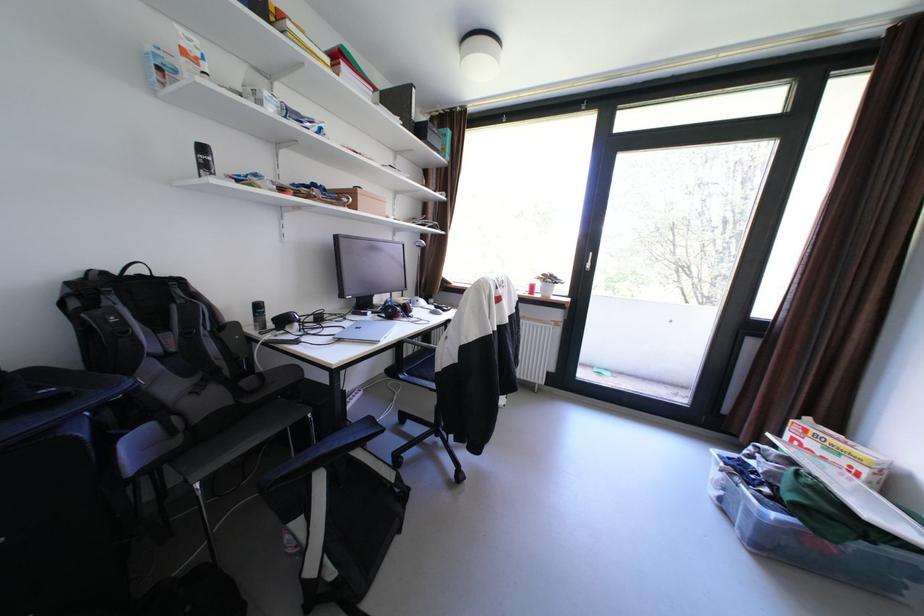
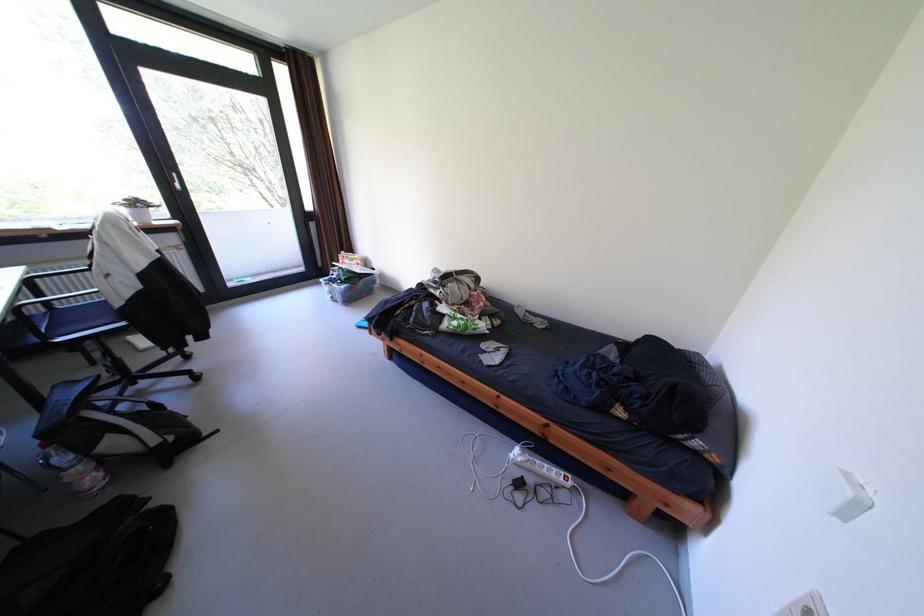
Find the pixel in the second image that matches (808,492) in the first image.

(355, 275)